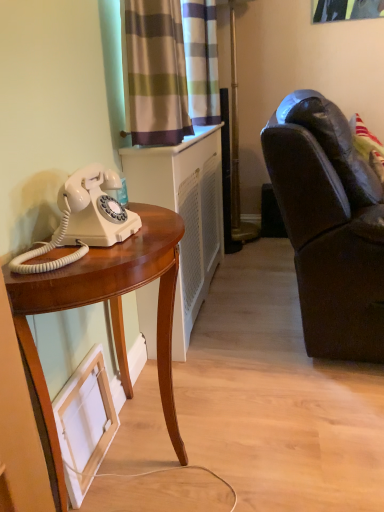
Measure the distance between point [52,494] and camera.

They are 33.62 inches apart.

Describe the element at coordinates (201, 60) in the screenshot. This screenshot has height=512, width=384. I see `striped fabric curtain at upper center, arranged as the 2th curtain when viewed from the front` at that location.

Locate an element on the screen. The width and height of the screenshot is (384, 512). dark brown leather couch at right is located at coordinates [329, 226].

Measure the distance between point (184,183) and camera.

The depth of point (184,183) is 1.66 meters.

Describe the element at coordinates (184, 213) in the screenshot. The height and width of the screenshot is (512, 384). I see `white plastic radiator at center` at that location.

Locate an element on the screen. white glossy rotary phone at left is located at coordinates (84, 219).

Which of these two, mahogany wood desk at left or striped fabric curtain at upper center, arranged as the 2th curtain when viewed from the front, stands taller?

mahogany wood desk at left.

From the image's perspective, relative to striped fabric curtain at upper center, arranged as the 2th curtain when viewed from the front, is mahogany wood desk at left above or below?

mahogany wood desk at left is situated lower than striped fabric curtain at upper center, arranged as the 2th curtain when viewed from the front, in the image.

From a real-world perspective, does mahogany wood desk at left stand above striped fabric curtain at upper center, arranged as the 2th curtain when viewed from the front?

Incorrect, from a real-world perspective, mahogany wood desk at left is lower than striped fabric curtain at upper center, arranged as the 2th curtain when viewed from the front.

Image resolution: width=384 pixels, height=512 pixels. What are the coordinates of `desk beneath the striped fabric curtain at upper center, arranged as the 2th curtain when viewed from the front (from a real-world perspective)` in the screenshot? It's located at (111, 315).

Is white plastic radiator at center looking in the opposite direction of dark brown leather couch at right?

Yes, dark brown leather couch at right is at the back of white plastic radiator at center.

Considering the points (178, 341) and (300, 153), which point is behind, point (178, 341) or point (300, 153)?

Positioned behind is point (178, 341).

Considering the sizes of objects white plastic radiator at center and dark brown leather couch at right in the image provided, who is thinner, white plastic radiator at center or dark brown leather couch at right?

white plastic radiator at center is thinner.

Is dark brown leather couch at right located within white plastic radiator at center?

That's incorrect, dark brown leather couch at right is not inside white plastic radiator at center.

Can you tell me how much white glossy rotary phone at left and white plastic radiator at center differ in facing direction?

The facing directions of white glossy rotary phone at left and white plastic radiator at center are 6.08 degrees apart.

Which of these two, white glossy rotary phone at left or white plastic radiator at center, stands shorter?

Standing shorter between the two is white glossy rotary phone at left.

In terms of size, does white glossy rotary phone at left appear bigger or smaller than white plastic radiator at center?

In the image, white glossy rotary phone at left appears to be smaller than white plastic radiator at center.

From the image's perspective, which one is positioned lower, white glossy rotary phone at left or white plastic radiator at center?

white glossy rotary phone at left.

Which object is further away from the camera, white glossy rotary phone at left or striped fabric curtain at upper center, positioned as the 1th curtain in back-to-front order?

striped fabric curtain at upper center, positioned as the 1th curtain in back-to-front order.

Considering the relative sizes of white glossy rotary phone at left and striped fabric curtain at upper center, arranged as the 2th curtain when viewed from the front, in the image provided, is white glossy rotary phone at left thinner than striped fabric curtain at upper center, arranged as the 2th curtain when viewed from the front,?

Yes, white glossy rotary phone at left is thinner than striped fabric curtain at upper center, arranged as the 2th curtain when viewed from the front.

Can we say dark brown leather couch at right lies outside white plastic radiator at center?

That's correct, dark brown leather couch at right is outside of white plastic radiator at center.

Is dark brown leather couch at right turned away from white plastic radiator at center?

Yes, white plastic radiator at center is at the back of dark brown leather couch at right.

From the image's perspective, is dark brown leather couch at right under white plastic radiator at center?

No, from the image's perspective, dark brown leather couch at right is not below white plastic radiator at center.

Considering the positions of objects dark brown leather couch at right and white plastic radiator at center in the image provided, who is behind, dark brown leather couch at right or white plastic radiator at center?

white plastic radiator at center.

From a real-world perspective, relative to striped fabric curtain at upper center, positioned as the 1th curtain in back-to-front order, is white matte picture frame at lower left vertically above or below?

In terms of real-world spatial position, white matte picture frame at lower left is below striped fabric curtain at upper center, positioned as the 1th curtain in back-to-front order.

Between white matte picture frame at lower left and striped fabric curtain at upper center, positioned as the 1th curtain in back-to-front order, which one appears on the right side from the viewer's perspective?

Positioned to the right is striped fabric curtain at upper center, positioned as the 1th curtain in back-to-front order.

Is white matte picture frame at lower left surrounding striped fabric curtain at upper center, arranged as the 2th curtain when viewed from the front?

Definitely not — striped fabric curtain at upper center, arranged as the 2th curtain when viewed from the front, is not inside white matte picture frame at lower left.

Considering the sizes of objects white matte picture frame at lower left and striped fabric curtain at upper center, positioned as the 1th curtain in back-to-front order, in the image provided, who is wider, white matte picture frame at lower left or striped fabric curtain at upper center, positioned as the 1th curtain in back-to-front order,?

With larger width is striped fabric curtain at upper center, positioned as the 1th curtain in back-to-front order.

Considering the sizes of objects striped fabric curtain at upper center, positioned as the 1th curtain in back-to-front order, and mahogany wood desk at left in the image provided, who is bigger, striped fabric curtain at upper center, positioned as the 1th curtain in back-to-front order, or mahogany wood desk at left?

With larger size is mahogany wood desk at left.

Considering the positions of points (201, 12) and (169, 403), is point (201, 12) closer to camera compared to point (169, 403)?

That is False.

Consider the image. From the image's perspective, is striped fabric curtain at upper center, arranged as the 2th curtain when viewed from the front, located above or below mahogany wood desk at left?

Clearly, from the image's perspective, striped fabric curtain at upper center, arranged as the 2th curtain when viewed from the front, is above mahogany wood desk at left.

Which is in front, striped fabric curtain at upper center, positioned as the 1th curtain in back-to-front order, or mahogany wood desk at left?

mahogany wood desk at left.

From the mahogany wood desk at left, count 2nd curtains backward and point to it. Please provide its 2D coordinates.

[(201, 60)]

Where is `cabinetry on the left of dark brown leather couch at right`? This screenshot has height=512, width=384. cabinetry on the left of dark brown leather couch at right is located at coordinates (184, 213).

Considering their positions, is striped fabric curtain at upper center, arranged as the 2th curtain when viewed from the front, positioned closer to white matte picture frame at lower left than dark brown leather couch at right?

dark brown leather couch at right lies closer to white matte picture frame at lower left than the other object.

Looking at the image, which one is located closer to mahogany wood desk at left, white matte picture frame at lower left or dark brown leather couch at right?

white matte picture frame at lower left.

Which object lies nearer to the anchor point mahogany wood desk at left, striped fabric curtain at upper center, positioned as the second curtain in back-to-front order, or white glossy rotary phone at left?

Among the two, white glossy rotary phone at left is located nearer to mahogany wood desk at left.

Considering their positions, is mahogany wood desk at left positioned further to dark brown leather couch at right than striped fabric curtain at upper center, arranged as the 2th curtain when viewed from the front?

striped fabric curtain at upper center, arranged as the 2th curtain when viewed from the front, is further to dark brown leather couch at right.

Estimate the real-world distances between objects in this image. Which object is further from white glossy rotary phone at left, white plastic radiator at center or white matte picture frame at lower left?

white plastic radiator at center is positioned further to the anchor white glossy rotary phone at left.

Considering their positions, is white plastic radiator at center positioned closer to striped fabric curtain at upper center, positioned as the second curtain in back-to-front order, than dark brown leather couch at right?

white plastic radiator at center is positioned closer to the anchor striped fabric curtain at upper center, positioned as the second curtain in back-to-front order.

Which object lies further to the anchor point white matte picture frame at lower left, white plastic radiator at center or dark brown leather couch at right?

dark brown leather couch at right is positioned further to the anchor white matte picture frame at lower left.

Considering their positions, is striped fabric curtain at upper center, positioned as the second curtain in back-to-front order, positioned closer to white plastic radiator at center than white matte picture frame at lower left?

striped fabric curtain at upper center, positioned as the second curtain in back-to-front order, is closer to white plastic radiator at center.

This screenshot has width=384, height=512. What are the coordinates of `cabinetry that lies between striped fabric curtain at upper center, acting as the first curtain starting from the front, and white matte picture frame at lower left from top to bottom` in the screenshot? It's located at (184, 213).

Image resolution: width=384 pixels, height=512 pixels. I want to click on studio couch between striped fabric curtain at upper center, positioned as the 1th curtain in back-to-front order, and mahogany wood desk at left, in the vertical direction, so click(x=329, y=226).

Find the location of `cabinetry between mahogany wood desk at left and dark brown leather couch at right`. cabinetry between mahogany wood desk at left and dark brown leather couch at right is located at coordinates (184, 213).

You are a GUI agent. You are given a task and a screenshot of the screen. Output one action in this format:
    pyautogui.click(x=<x>, y=<y>)
    Task: Click on the desk between striped fabric curtain at upper center, acting as the first curtain starting from the front, and white matte picture frame at lower left from top to bottom
    
    Given the screenshot: What is the action you would take?
    pyautogui.click(x=111, y=315)